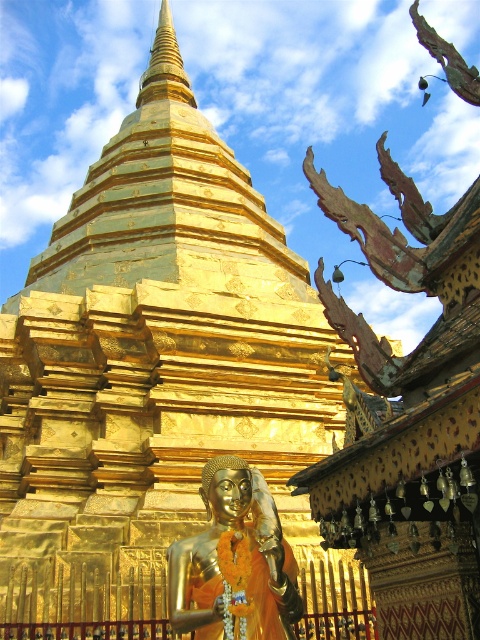
You are a photographer standing in front of the golden pagoda and want to capture both the gold metallic statue at center and the gold polished spire at upper center in a single frame. Based on their positions, which object should you adjust your camera to focus on first to ensure both are in the shot?

The gold metallic statue at center is positioned on the right side of gold polished spire at upper center, so you should focus on the gold polished spire at upper center first to ensure both are included in the frame.

You are standing in front of the golden pagoda and want to place a small offering at the base of the statue. The coordinates for the pagoda and statue are given as point 1 at [255,516] and point 2 at [176,52]. Which coordinate corresponds to the statue of Buddha?

Point 1 at [255,516] corresponds to the statue of Buddha because it is closer to the viewer than point 2 at [176,52], which is further away.